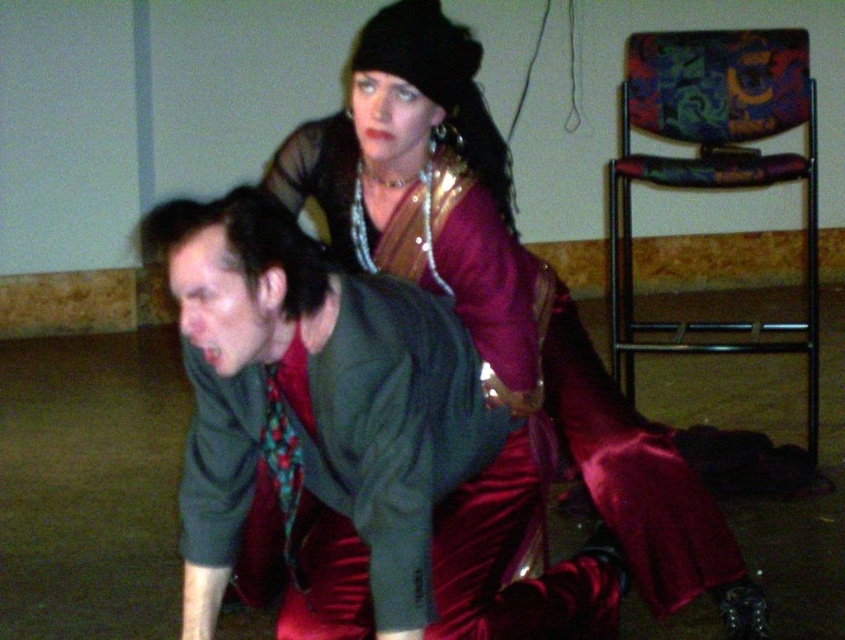
Is satin burgundy dress at upper center taller than green matte shirt at center?

Correct, satin burgundy dress at upper center is much taller as green matte shirt at center.

Between satin burgundy dress at upper center and green matte shirt at center, which one is positioned higher?

satin burgundy dress at upper center is higher up.

Locate an element on the screen. satin burgundy dress at upper center is located at coordinates (504, 353).